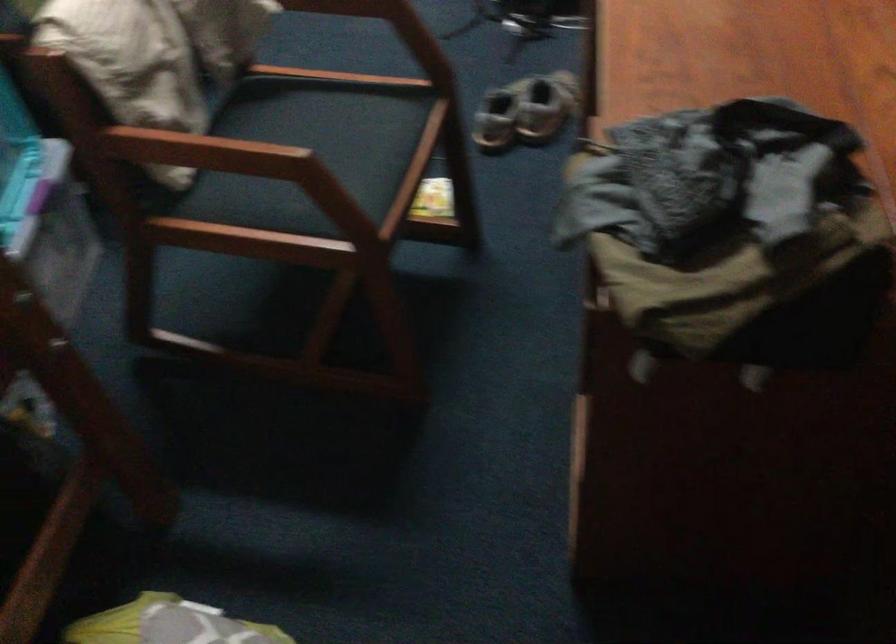
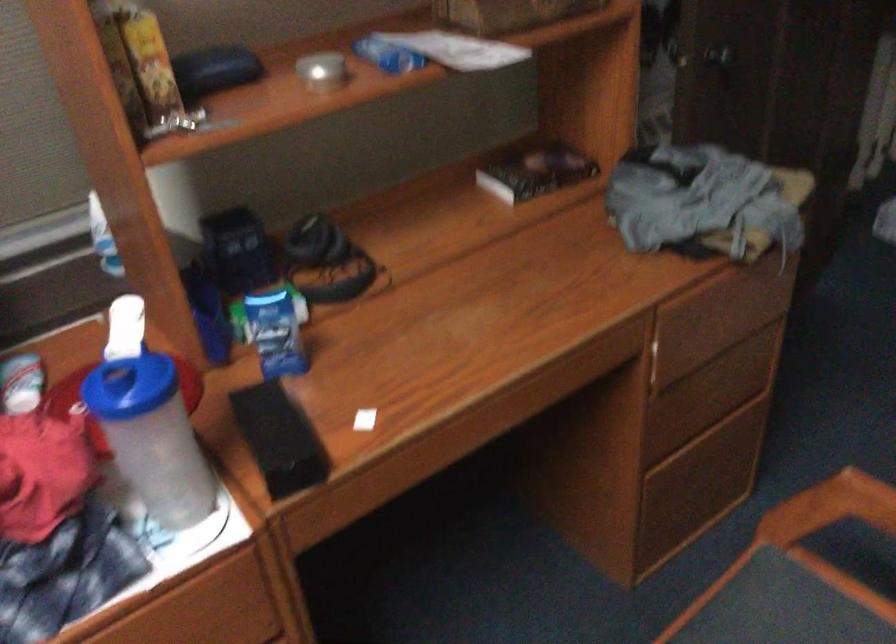
The point at (384, 205) is marked in the first image. Where is the corresponding point in the second image?

(780, 614)